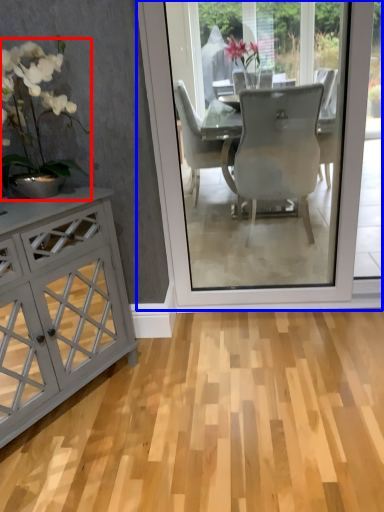
Question: Among these objects, which one is farthest to the camera, houseplant (highlighted by a red box) or screen door (highlighted by a blue box)?

Choices:
 (A) houseplant
 (B) screen door

Answer: (B)